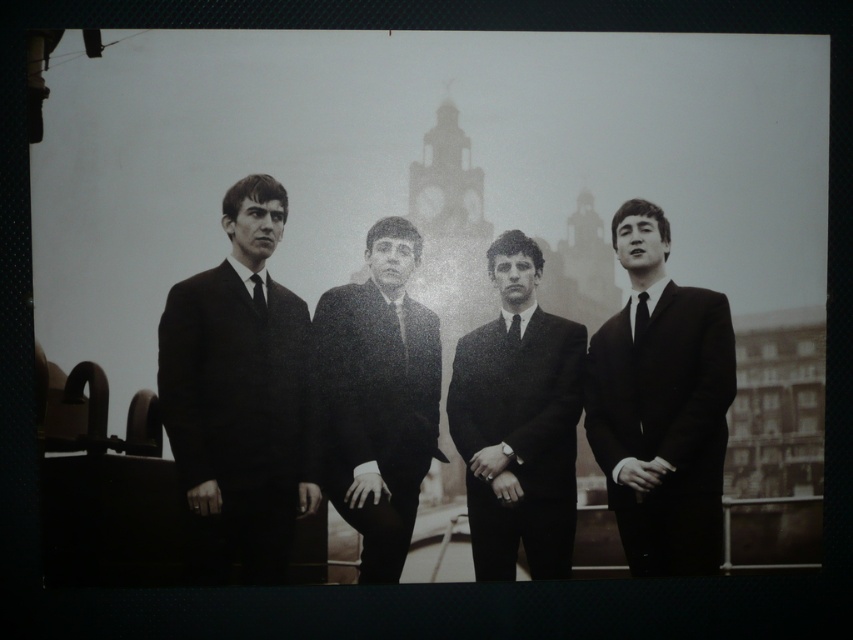
Question: Which object is positioned closest to the black silk tie at center?

Choices:
 (A) matte black tie at center
 (B) black silk tie at right
 (C) matte black suit at center
 (D) smooth black suit at center

Answer: (C)

Question: Which object is the farthest from the black silk tie at right?

Choices:
 (A) matte black suit at right
 (B) smooth black suit at center
 (C) matte black suit at center

Answer: (B)

Question: Which of the following is the closest to the observer?

Choices:
 (A) matte black suit at right
 (B) matte black tie at center
 (C) matte black suit at left

Answer: (C)

Question: Can you confirm if matte black suit at right is positioned to the left of black silk tie at right?

Choices:
 (A) yes
 (B) no

Answer: (B)

Question: Is matte black suit at left thinner than smooth black suit at center?

Choices:
 (A) yes
 (B) no

Answer: (B)

Question: Is matte black suit at left above matte black suit at right?

Choices:
 (A) yes
 (B) no

Answer: (A)